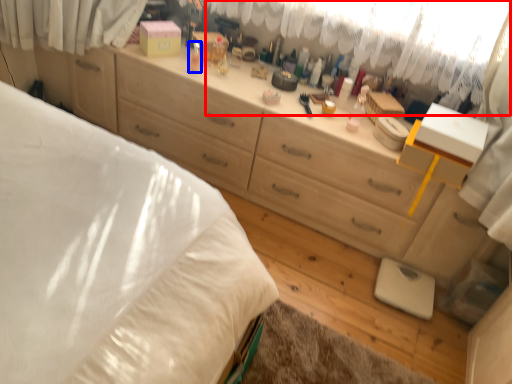
Question: Which point is closer to the camera, curtain (highlighted by a red box) or toiletry (highlighted by a blue box)?

Choices:
 (A) curtain
 (B) toiletry

Answer: (A)